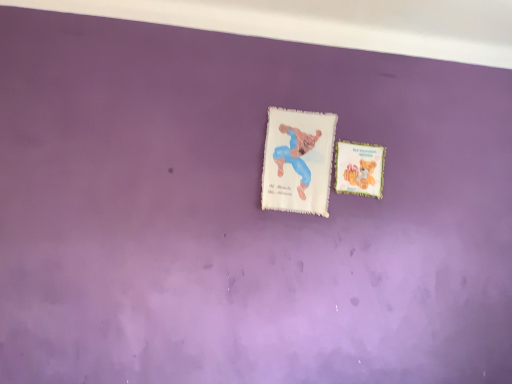
Question: Could you tell me if matte paper postcard at upper right, marked as the 1th postcard in a right-to-left arrangement, is turned towards white fluffy postcard at center, which is the 2th postcard from right to left?

Choices:
 (A) no
 (B) yes

Answer: (A)

Question: From a real-world perspective, is matte paper postcard at upper right, which is the 2th postcard from left to right, physically above white fluffy postcard at center, which appears as the 1th postcard when viewed from the left?

Choices:
 (A) no
 (B) yes

Answer: (B)

Question: Does matte paper postcard at upper right, marked as the 1th postcard in a right-to-left arrangement, touch white fluffy postcard at center, which appears as the 1th postcard when viewed from the left?

Choices:
 (A) no
 (B) yes

Answer: (A)

Question: Considering the relative positions of matte paper postcard at upper right, which is the 2th postcard from left to right, and white fluffy postcard at center, which is the 2th postcard from right to left, in the image provided, is matte paper postcard at upper right, which is the 2th postcard from left to right, behind white fluffy postcard at center, which is the 2th postcard from right to left,?

Choices:
 (A) yes
 (B) no

Answer: (A)

Question: Would you say matte paper postcard at upper right, which is the 2th postcard from left to right, is outside white fluffy postcard at center, which is the 2th postcard from right to left?

Choices:
 (A) no
 (B) yes

Answer: (B)

Question: From a real-world perspective, does matte paper postcard at upper right, which is the 2th postcard from left to right, sit lower than white fluffy postcard at center, which appears as the 1th postcard when viewed from the left?

Choices:
 (A) no
 (B) yes

Answer: (A)

Question: Does white fluffy postcard at center, which is the 2th postcard from right to left, have a smaller size compared to matte paper postcard at upper right, which is the 2th postcard from left to right?

Choices:
 (A) yes
 (B) no

Answer: (B)

Question: Considering the relative sizes of white fluffy postcard at center, which appears as the 1th postcard when viewed from the left, and matte paper postcard at upper right, marked as the 1th postcard in a right-to-left arrangement, in the image provided, is white fluffy postcard at center, which appears as the 1th postcard when viewed from the left, bigger than matte paper postcard at upper right, marked as the 1th postcard in a right-to-left arrangement,?

Choices:
 (A) no
 (B) yes

Answer: (B)

Question: Is the position of white fluffy postcard at center, which appears as the 1th postcard when viewed from the left, less distant than that of matte paper postcard at upper right, which is the 2th postcard from left to right?

Choices:
 (A) yes
 (B) no

Answer: (A)

Question: Is white fluffy postcard at center, which is the 2th postcard from right to left, facing towards matte paper postcard at upper right, marked as the 1th postcard in a right-to-left arrangement?

Choices:
 (A) yes
 (B) no

Answer: (B)

Question: From a real-world perspective, is white fluffy postcard at center, which appears as the 1th postcard when viewed from the left, below matte paper postcard at upper right, which is the 2th postcard from left to right?

Choices:
 (A) no
 (B) yes

Answer: (B)

Question: From a real-world perspective, is white fluffy postcard at center, which appears as the 1th postcard when viewed from the left, on top of matte paper postcard at upper right, marked as the 1th postcard in a right-to-left arrangement?

Choices:
 (A) no
 (B) yes

Answer: (A)

Question: Would you say white fluffy postcard at center, which appears as the 1th postcard when viewed from the left, is inside or outside matte paper postcard at upper right, which is the 2th postcard from left to right?

Choices:
 (A) outside
 (B) inside

Answer: (A)